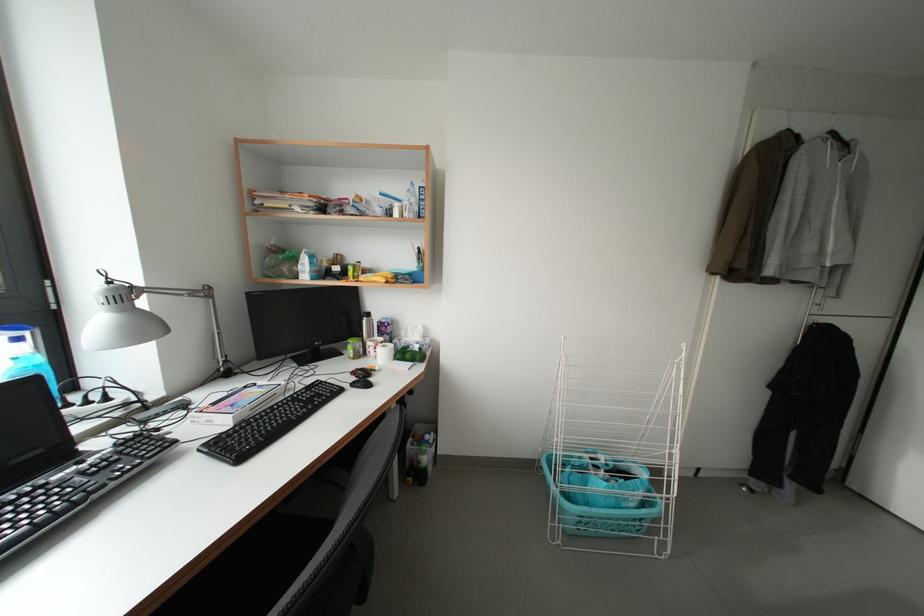
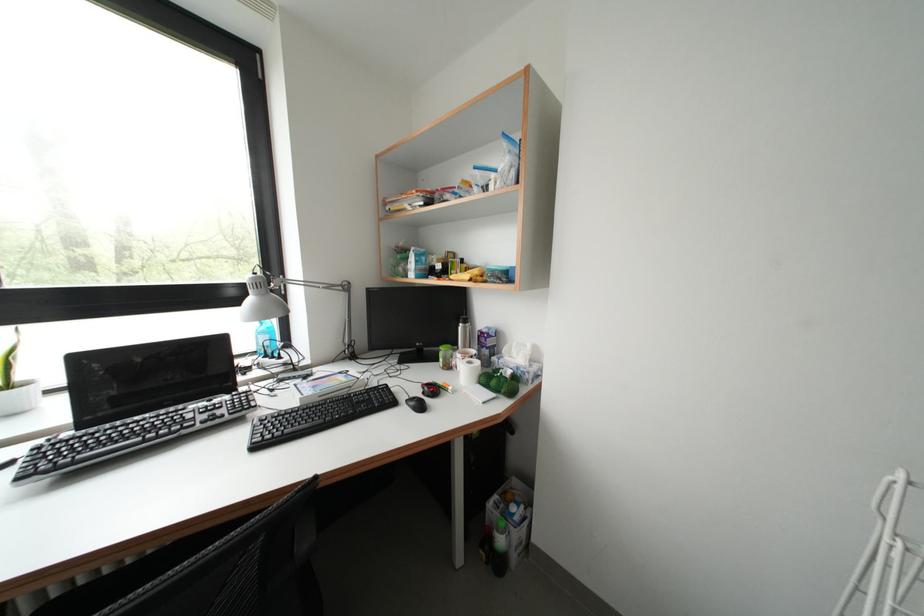
Find the pixel in the second image that matches point 388,347 in the first image.

(479, 362)